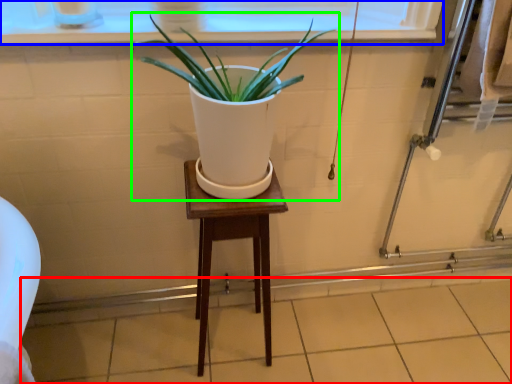
Question: Considering the real-world distances, which object is closest to tile (highlighted by a red box)? window frame (highlighted by a blue box) or houseplant (highlighted by a green box).

Choices:
 (A) window frame
 (B) houseplant

Answer: (B)